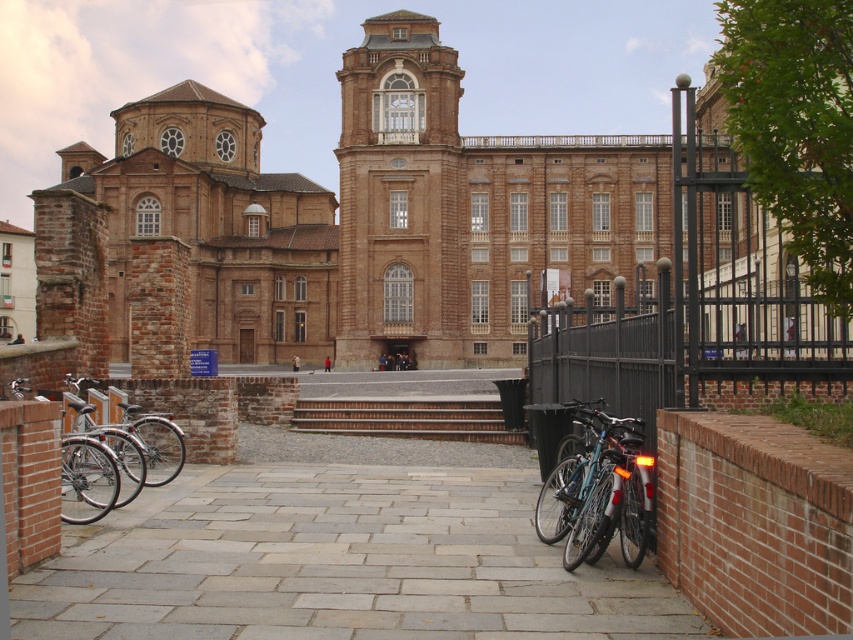
Measure the distance from shiny blue bike at lower right to silver metallic bicycle at lower left.

shiny blue bike at lower right and silver metallic bicycle at lower left are 81.17 feet apart.

Which of these two, shiny blue bike at lower right or silver metallic bicycle at lower left, stands taller?

shiny blue bike at lower right

Between point (610, 419) and point (120, 444), which one is positioned in front?

Point (610, 419) is in front.

Locate an element on the screen. Image resolution: width=853 pixels, height=640 pixels. shiny blue bike at lower right is located at coordinates (598, 490).

Is shiny blue bike at lower right thinner than brick/stone stairs at center?

Yes.

In the scene shown: Which of these two, shiny blue bike at lower right or brick/stone stairs at center, stands taller?

shiny blue bike at lower right is taller.

Between point (585, 440) and point (308, 417), which one is positioned behind?

The point (308, 417) is more distant.

In order to click on shiny blue bike at lower right in this screenshot , I will do `click(598, 490)`.

Is brick/stone stairs at center wider than silver metallic bicycle at lower left?

Yes.

How far apart are brick/stone stairs at center and silver metallic bicycle at lower left?

They are 27.41 meters apart.

Between point (465, 413) and point (84, 403), which one is positioned behind?

Point (465, 413)

Where is `brick/stone stairs at center`? Image resolution: width=853 pixels, height=640 pixels. brick/stone stairs at center is located at coordinates (407, 419).